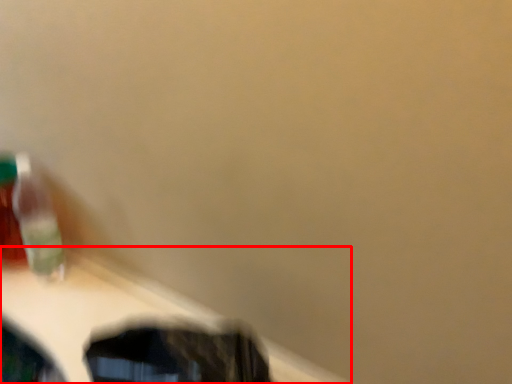
Question: From the image's perspective, what is the correct spatial positioning of table (annotated by the red box) in reference to toothbrush?

Choices:
 (A) below
 (B) above

Answer: (A)